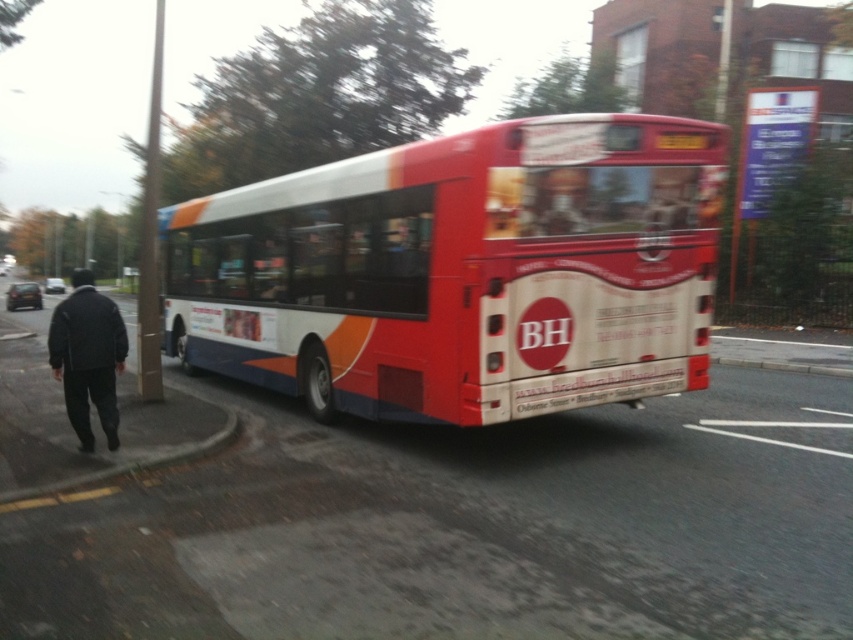
Question: Which point is farther from the camera taking this photo?

Choices:
 (A) (48, 356)
 (B) (361, 282)

Answer: (A)

Question: Does red matte bus at center appear under dark gray jacket at left?

Choices:
 (A) yes
 (B) no

Answer: (A)

Question: Is red matte bus at center positioned behind dark gray jacket at left?

Choices:
 (A) yes
 (B) no

Answer: (B)

Question: Is the position of red matte bus at center less distant than that of dark gray jacket at left?

Choices:
 (A) no
 (B) yes

Answer: (B)

Question: Among these objects, which one is nearest to the camera?

Choices:
 (A) red matte bus at center
 (B) dark gray jacket at left

Answer: (A)

Question: Which of the following is the farthest from the observer?

Choices:
 (A) red matte bus at center
 (B) dark gray jacket at left

Answer: (B)